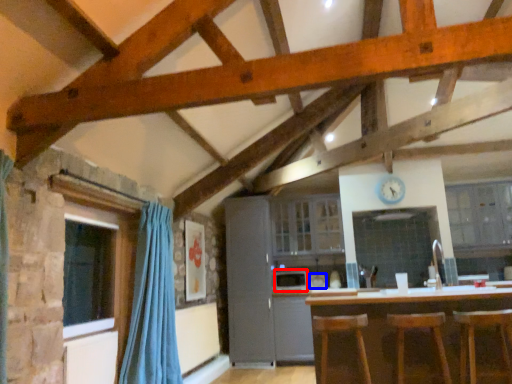
Question: Which object appears closest to the camera in this image, appliance (highlighted by a red box) or appliance (highlighted by a blue box)?

Choices:
 (A) appliance
 (B) appliance

Answer: (A)